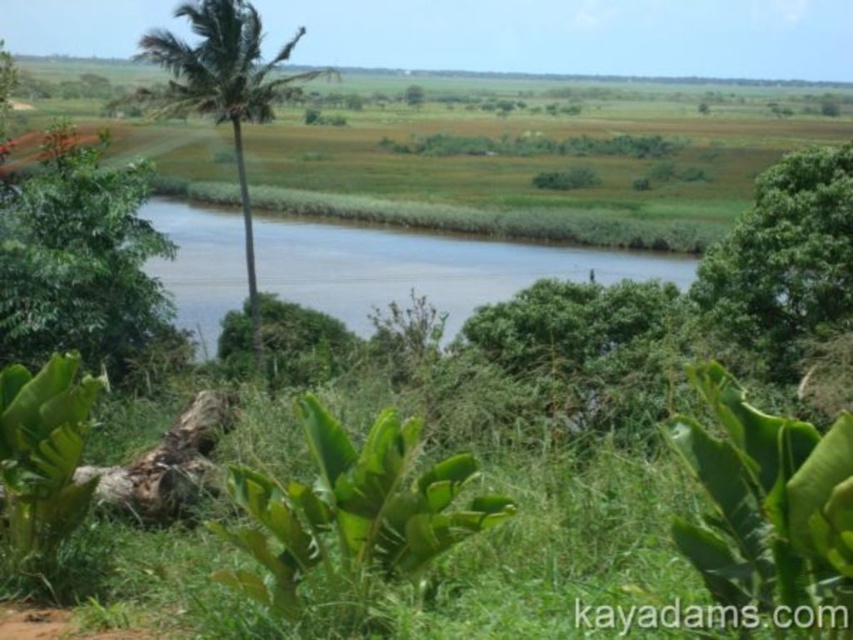
You are a hiker who wants to take a photo of both the green leafy tree at left and the green leafy palm tree at left. Since you have a camera with a limited zoom, which tree should you move closer to in order to capture both in the same frame?

The green leafy tree at left is smaller in size compared to the green leafy palm tree at left. To capture both in the same frame, you should move closer to the green leafy palm tree at left because its larger size will allow you to include both trees without needing excessive zoom.

You are standing in the lush landscape and want to take a photo of both the green leafy tree at left and the green leafy palm tree at left. Which tree should you focus on first to ensure both are in the frame?

You should focus on the green leafy tree at left first because it is closer to you than the green leafy palm tree at left, so adjusting the camera to include both would require framing from the closer object outward.